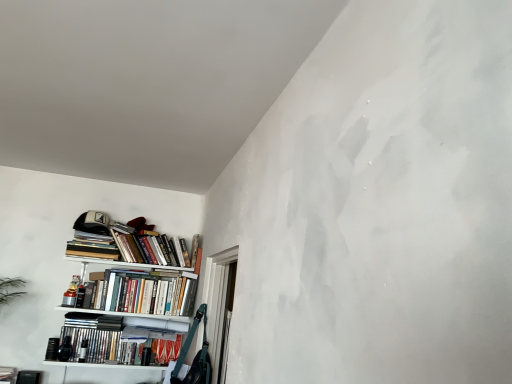
Question: Can you confirm if hardcover books at center, which is counted as the third book, starting from the top, is positioned to the right of white matte bookshelf at left?

Choices:
 (A) yes
 (B) no

Answer: (A)

Question: Considering the relative sizes of hardcover books at center, the 2th book ordered from the bottom, and white matte bookshelf at left in the image provided, is hardcover books at center, the 2th book ordered from the bottom, shorter than white matte bookshelf at left?

Choices:
 (A) yes
 (B) no

Answer: (A)

Question: Would you say white matte bookshelf at left is part of hardcover books at center, which is counted as the third book, starting from the top,'s contents?

Choices:
 (A) no
 (B) yes

Answer: (A)

Question: Can you confirm if hardcover books at center, which is counted as the third book, starting from the top, is smaller than white matte bookshelf at left?

Choices:
 (A) no
 (B) yes

Answer: (B)

Question: Is hardcover books at center, the 2th book ordered from the bottom, located outside white matte bookshelf at left?

Choices:
 (A) no
 (B) yes

Answer: (A)

Question: From a real-world perspective, relative to matte black bookshelf at lower left, the 4th book positioned from the top, is transparent plastic window at lower left vertically above or below?

Choices:
 (A) above
 (B) below

Answer: (A)

Question: From the image's perspective, relative to matte black bookshelf at lower left, the 4th book positioned from the top, is transparent plastic window at lower left above or below?

Choices:
 (A) below
 (B) above

Answer: (B)

Question: Is point (207, 268) positioned closer to the camera than point (75, 317)?

Choices:
 (A) closer
 (B) farther

Answer: (A)

Question: Considering their positions, is transparent plastic window at lower left located in front of or behind matte black bookshelf at lower left, the 4th book positioned from the top?

Choices:
 (A) behind
 (B) front

Answer: (B)

Question: Is transparent plastic window at lower left wider or thinner than white matte bookshelf at left?

Choices:
 (A) wide
 (B) thin

Answer: (B)

Question: In terms of height, does transparent plastic window at lower left look taller or shorter compared to white matte bookshelf at left?

Choices:
 (A) short
 (B) tall

Answer: (A)

Question: From the image's perspective, is transparent plastic window at lower left positioned above or below white matte bookshelf at left?

Choices:
 (A) above
 (B) below

Answer: (A)

Question: Does point (210, 317) appear closer or farther from the camera than point (98, 352)?

Choices:
 (A) farther
 (B) closer

Answer: (B)

Question: From a real-world perspective, is hardcover books at upper left, the second book positioned from the top, positioned above or below hardcover books at center, which is counted as the third book, starting from the top?

Choices:
 (A) above
 (B) below

Answer: (A)

Question: Based on their positions, is hardcover books at upper left, arranged as the 3th book when ordered from the bottom, located to the left or right of hardcover books at center, the 2th book ordered from the bottom?

Choices:
 (A) right
 (B) left

Answer: (A)